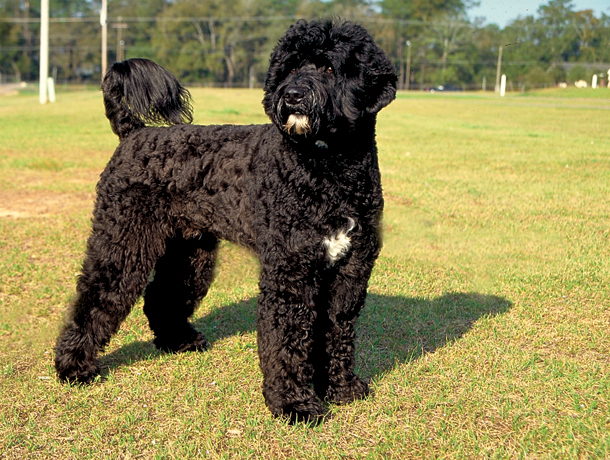
I want to click on left front leg, so click(343, 286).